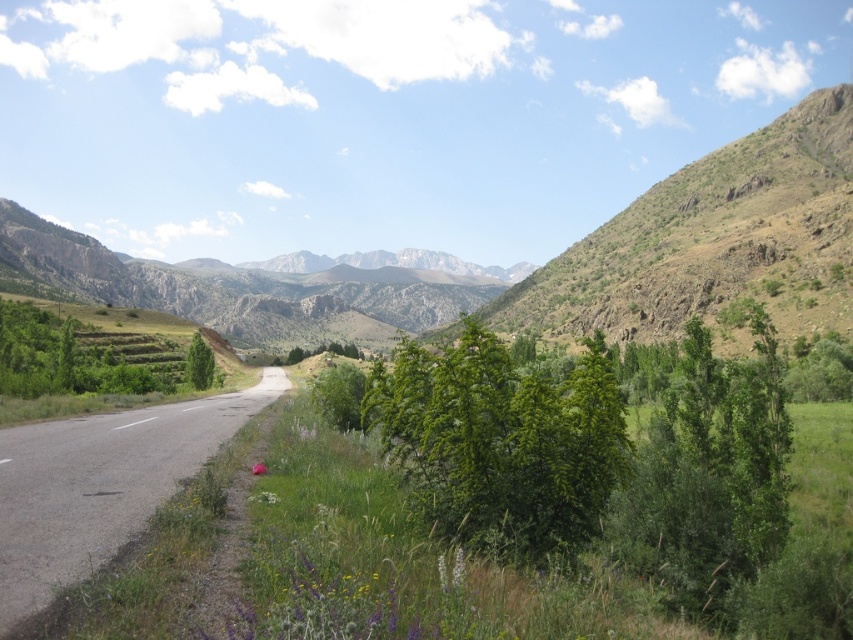
You are a hiker standing at the starting point of the trail. You need to reach the green grassy mountain at center. Which direction should you head relative to the green asphalt road at center?

You should head to the left of the green asphalt road at center because the green grassy mountain at center is located to the left of the road.

From the picture: You are a drone operator trying to capture a photo of the green asphalt road at center. The camera is currently positioned at point 0.5, 0.5. To get the best shot, you need to adjust the camera to the road location. What direction should you move the camera to align with the road?

The green asphalt road at center is located at point (100, 484). Since the camera is at (426, 320), you should move the camera to the right and down to align with the road.

You are a hiker standing at the base of the green grassy mountain at center. You want to reach the green asphalt road at center. Given that your average walking speed is 5 km per hour, how long would it take you to walk straight to the road?

The distance between the green asphalt road at center and green grassy mountain at center is 455.35 meters. Converting 5 km per hour to meters per minute gives approximately 83.33 meters per minute. Dividing 455.35 by 83.33 yields roughly 5.46 minutes. Therefore, it would take approximately 5 and a half minutes to walk straight to the road.